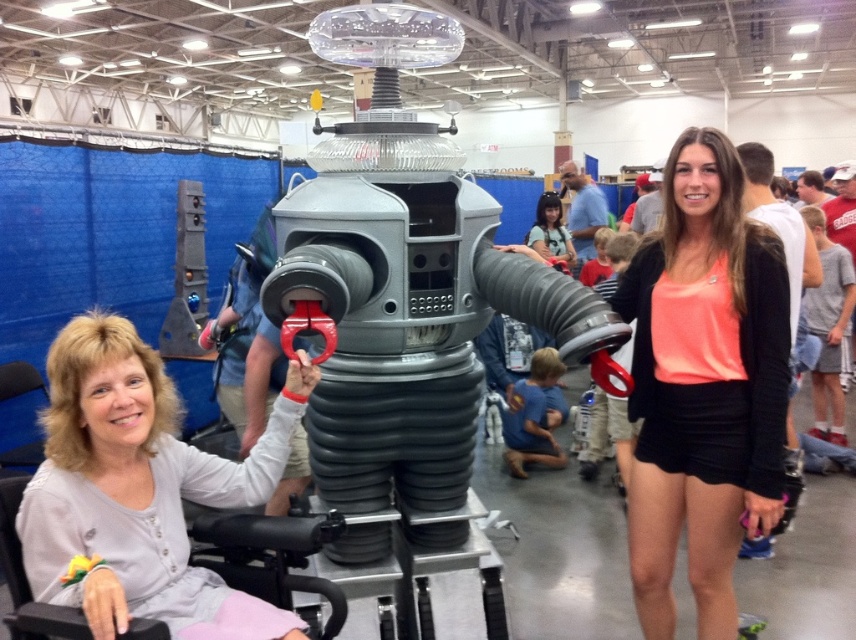
Can you confirm if neon orange fabric at center is positioned to the left of light gray fabric at left?

No, neon orange fabric at center is not to the left of light gray fabric at left.

From the picture: Is neon orange fabric at center positioned at the back of light gray fabric at left?

Yes, neon orange fabric at center is behind light gray fabric at left.

Measure the distance between point (652, 440) and camera.

The distance of point (652, 440) from camera is 7.23 feet.

Image resolution: width=856 pixels, height=640 pixels. I want to click on neon orange fabric at center, so click(x=703, y=387).

Is point (230, 500) closer to viewer compared to point (554, 205)?

Yes, point (230, 500) is closer to viewer.

At what (x,y) coordinates should I click in order to perform the action: click on light gray fabric at left. Please return your answer as a coordinate pair (x, y). The width and height of the screenshot is (856, 640). Looking at the image, I should click on (140, 490).

In the scene shown: Is neon orange fabric at center taller than matte black hair at center?

Correct, neon orange fabric at center is much taller as matte black hair at center.

Who is positioned more to the right, neon orange fabric at center or matte black hair at center?

From the viewer's perspective, matte black hair at center appears more on the right side.

Which is in front, point (785, 316) or point (568, 236)?

Point (785, 316) is more forward.

You are a GUI agent. You are given a task and a screenshot of the screen. Output one action in this format:
    pyautogui.click(x=<x>, y=<y>)
    Task: Click on the neon orange fabric at center
    
    Given the screenshot: What is the action you would take?
    pyautogui.click(x=703, y=387)